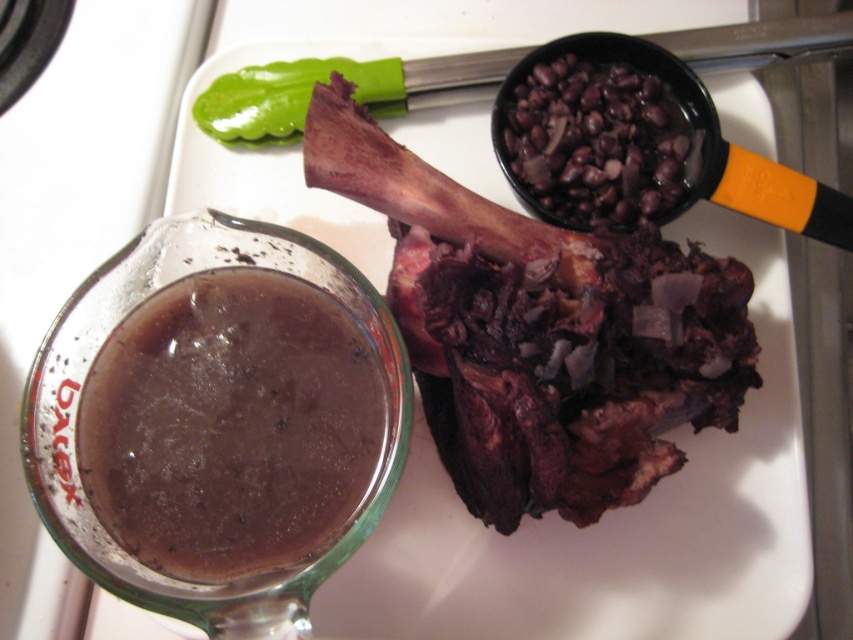
Is translucent glass gravy at lower left above black matte beans at upper right?

Actually, translucent glass gravy at lower left is below black matte beans at upper right.

Can you confirm if translucent glass gravy at lower left is taller than black matte beans at upper right?

Yes.

Describe the element at coordinates (230, 426) in the screenshot. This screenshot has height=640, width=853. I see `translucent glass gravy at lower left` at that location.

You are a GUI agent. You are given a task and a screenshot of the screen. Output one action in this format:
    pyautogui.click(x=<x>, y=<y>)
    Task: Click on the translucent glass gravy at lower left
    This screenshot has width=853, height=640.
    Given the screenshot: What is the action you would take?
    pyautogui.click(x=230, y=426)

Which is more to the right, dark brown meat at center or black matte beans at upper right?

Positioned to the right is black matte beans at upper right.

Looking at this image, is dark brown meat at center taller than black matte beans at upper right?

Correct, dark brown meat at center is much taller as black matte beans at upper right.

What are the coordinates of `dark brown meat at center` in the screenshot? It's located at (541, 332).

Looking at this image, is dark brown meat at center shorter than translucent glass gravy at lower left?

No, dark brown meat at center is not shorter than translucent glass gravy at lower left.

Is dark brown meat at center smaller than translucent glass gravy at lower left?

Actually, dark brown meat at center might be larger than translucent glass gravy at lower left.

Who is more forward, (343, 93) or (200, 451)?

Point (200, 451) is in front.

Find the location of a particular element. dark brown meat at center is located at coordinates (541, 332).